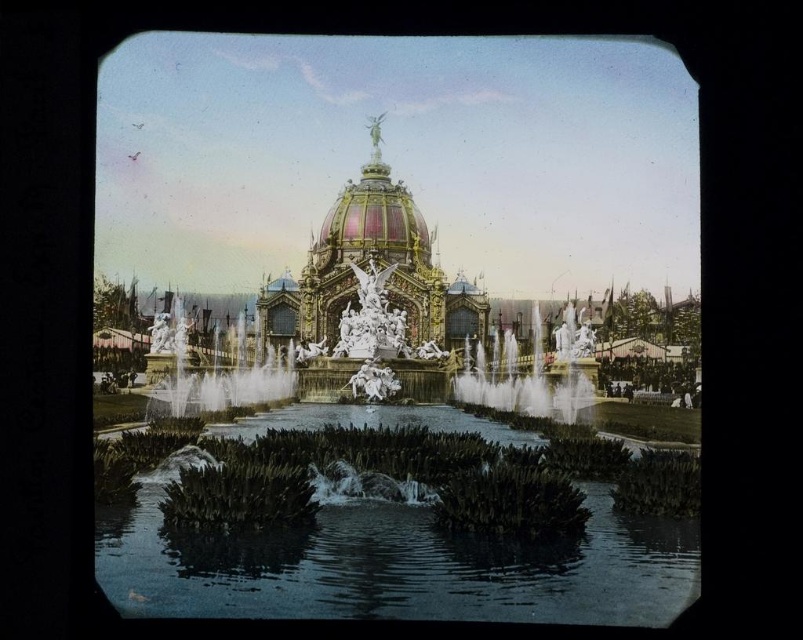
You are standing in front of the grand pavilion and notice the clear water at center and the white marble fountain at center. Which object is located to the right of the other?

The clear water at center is positioned on the right side of white marble fountain at center.

You are standing in front of the grand pavilion and want to find the clear water at center. According to the coordinates provided, where should you look to locate it?

The clear water at center is located at coordinates point (394, 564).